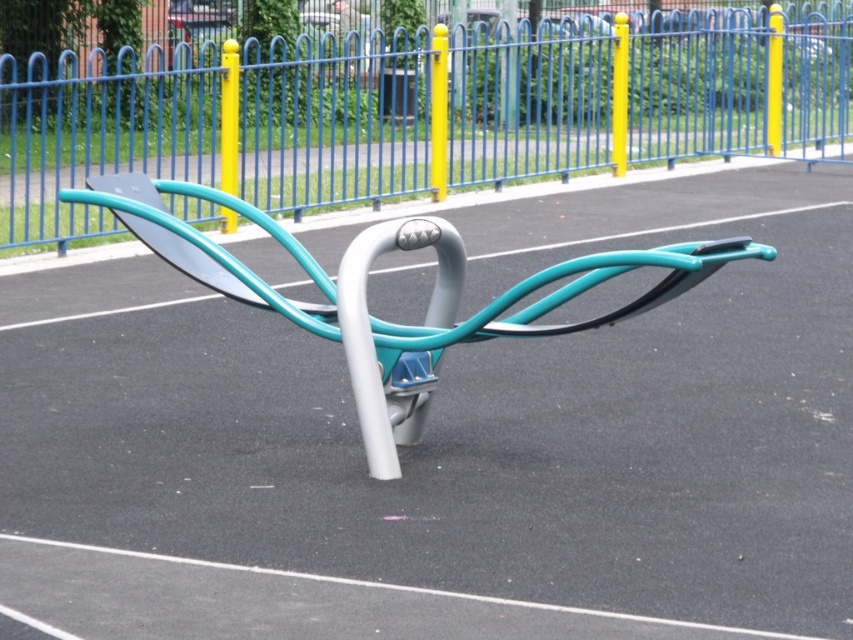
Does blue metal fence at upper center have a greater width compared to yellow glossy pole at upper center?

Yes, blue metal fence at upper center is wider than yellow glossy pole at upper center.

This screenshot has width=853, height=640. What do you see at coordinates (97, 132) in the screenshot?
I see `blue metal fence at upper center` at bounding box center [97, 132].

Locate an element on the screen. Image resolution: width=853 pixels, height=640 pixels. blue metal fence at upper center is located at coordinates (97, 132).

Does matte yellow pole at upper right have a greater height compared to yellow matte pole at upper right?

No, matte yellow pole at upper right is not taller than yellow matte pole at upper right.

Is point (614, 32) farther from camera compared to point (773, 154)?

No, it is in front of (773, 154).

Between point (624, 32) and point (766, 116), which one is positioned in front?

Point (624, 32) is in front.

Identify the location of matte yellow pole at upper right. (619, 93).

Can you confirm if blue metal fence at upper center is positioned to the right of yellow matte pole at center?

No, blue metal fence at upper center is not to the right of yellow matte pole at center.

Where is `blue metal fence at upper center`? Image resolution: width=853 pixels, height=640 pixels. blue metal fence at upper center is located at coordinates (97, 132).